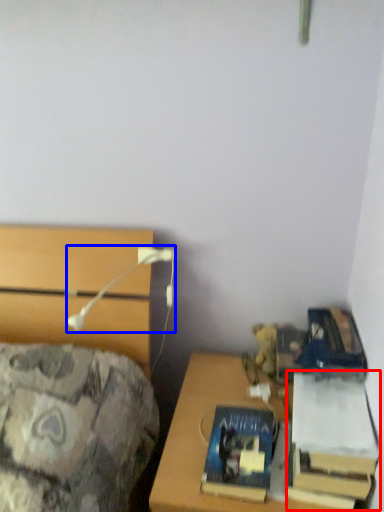
Question: Which point is closer to the camera, book (highlighted by a red box) or table lamp (highlighted by a blue box)?

Choices:
 (A) book
 (B) table lamp

Answer: (A)